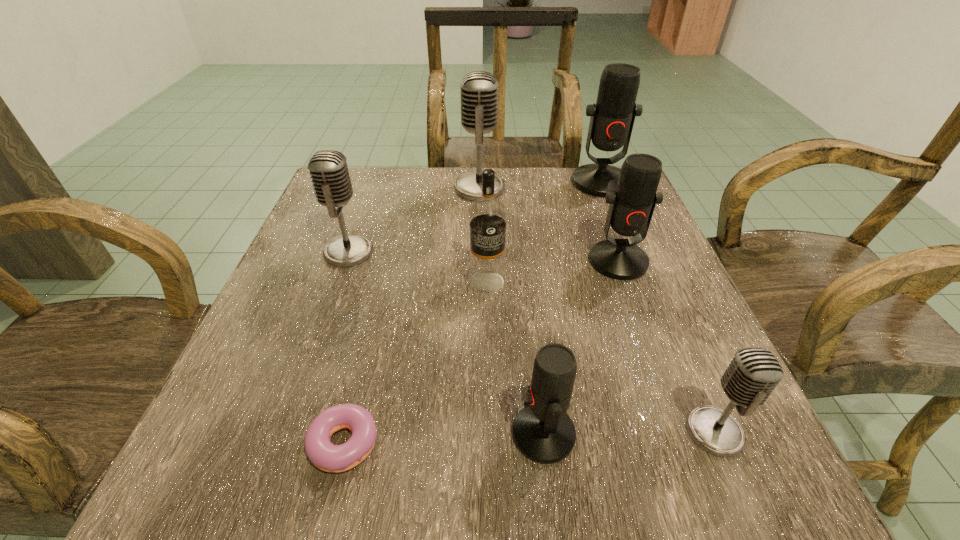
Locate an element on the screen. Image resolution: width=960 pixels, height=540 pixels. the second gray microphone from right to left is located at coordinates (478, 89).

In order to click on the farthest gray microphone in this screenshot , I will do `click(478, 89)`.

The height and width of the screenshot is (540, 960). I want to click on the farthest red microphone, so click(x=612, y=118).

I want to click on vodka, so click(x=487, y=216).

Where is `the second biggest red microphone`? The image size is (960, 540). the second biggest red microphone is located at coordinates (631, 207).

The image size is (960, 540). Identify the location of the leftmost microphone. (328, 169).

Image resolution: width=960 pixels, height=540 pixels. I want to click on the second biggest gray microphone, so click(328, 169).

You are a GUI agent. You are given a task and a screenshot of the screen. Output one action in this format:
    pyautogui.click(x=<x>, y=<y>)
    Task: Click on the nearest red microphone
    
    Given the screenshot: What is the action you would take?
    pyautogui.click(x=542, y=431)

Find the location of a particular element. The height and width of the screenshot is (540, 960). the leftmost red microphone is located at coordinates (542, 431).

Image resolution: width=960 pixels, height=540 pixels. I want to click on the nearest gray microphone, so click(x=753, y=373).